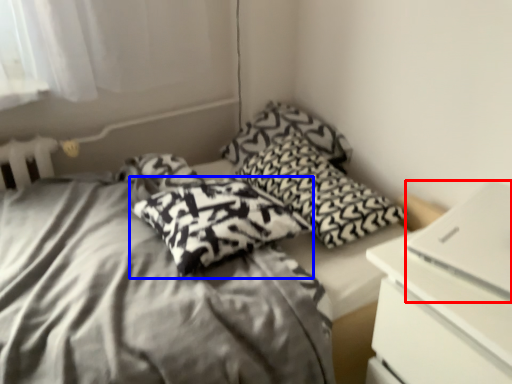
Question: Which object is further to the camera taking this photo, computer (highlighted by a red box) or pillow (highlighted by a blue box)?

Choices:
 (A) computer
 (B) pillow

Answer: (B)